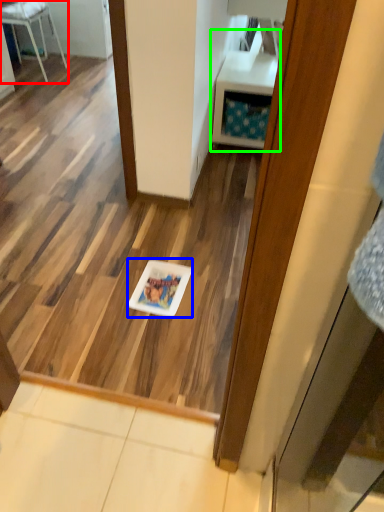
Question: Based on their relative distances, which object is nearer to furniture (highlighted by a red box)? Choose from glass plate (highlighted by a blue box) and vanity (highlighted by a green box).

Choices:
 (A) glass plate
 (B) vanity

Answer: (B)